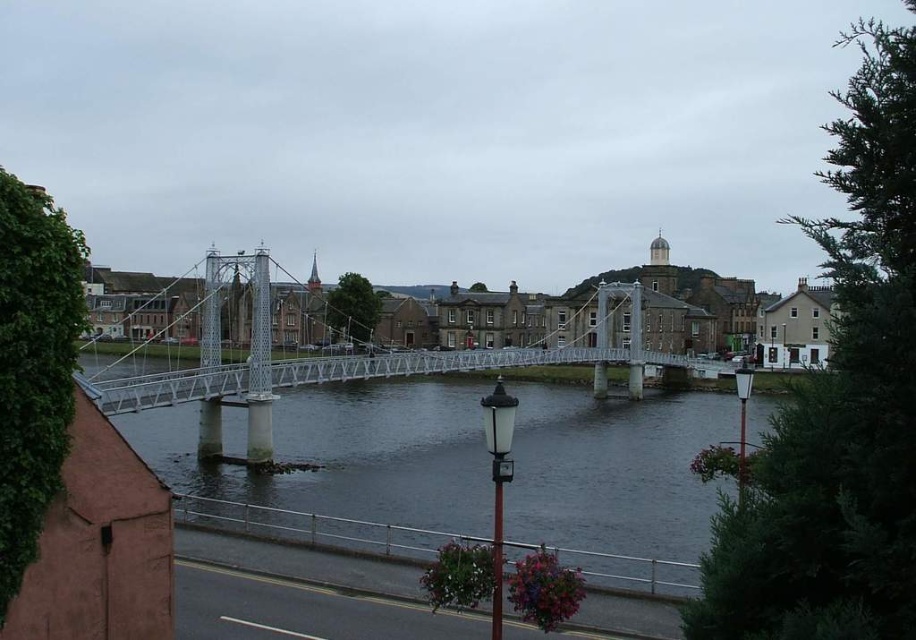
You are standing on the suspension bridge and notice the clear water at center and the white plastic lamp post at lower right. Which object is taller from your viewpoint?

The white plastic lamp post at lower right is taller than the clear water at center.

You are a tourist standing on the riverside path and want to take a photo of the white metal bridge at center and the white glossy lamp post at center. Which object is closer to you, and which one is farther away?

The white metal bridge at center is positioned over the white glossy lamp post at center, so the lamp post is farther away while the bridge is closer to you.